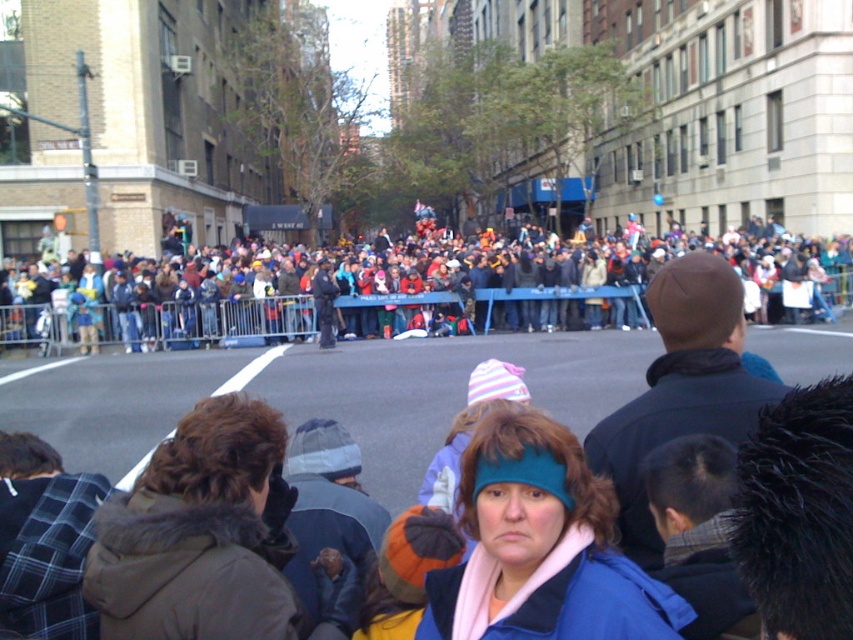
Question: Which object is farther from the camera taking this photo?

Choices:
 (A) blue fleece jacket at center
 (B) multicolored fabric crowd at center

Answer: (B)

Question: Does multicolored fabric crowd at center appear on the left side of blue fleece jacket at center?

Choices:
 (A) yes
 (B) no

Answer: (B)

Question: Does multicolored fabric crowd at center have a larger size compared to blue fleece jacket at center?

Choices:
 (A) no
 (B) yes

Answer: (B)

Question: Is multicolored fabric crowd at center above blue fleece jacket at center?

Choices:
 (A) no
 (B) yes

Answer: (B)

Question: Which point is farther to the camera?

Choices:
 (A) multicolored fabric crowd at center
 (B) blue fleece jacket at center

Answer: (A)